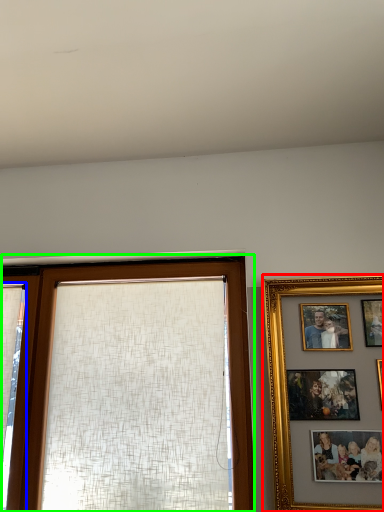
Question: Based on their relative distances, which object is farther from picture frame (highlighted by a red box)? Choose from curtain (highlighted by a blue box) and window (highlighted by a green box).

Choices:
 (A) curtain
 (B) window

Answer: (A)